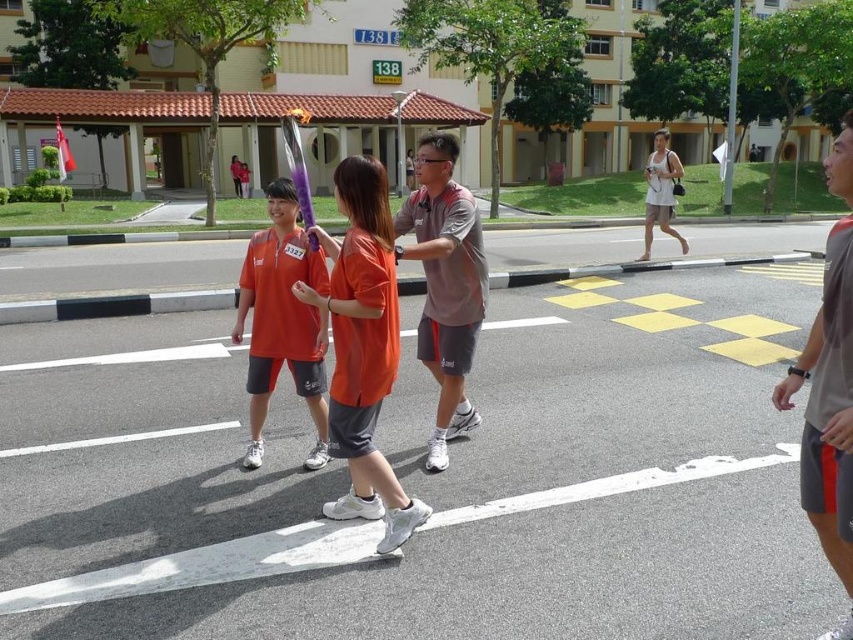
Question: Considering the real-world distances, which object is farthest from the gray matte shirt at center?

Choices:
 (A) gray fabric shorts at right
 (B) matte orange shirt at center

Answer: (A)

Question: Which of the following is the farthest from the observer?

Choices:
 (A) gray matte shirt at center
 (B) matte orange shirt at center
 (C) gray fabric shorts at right

Answer: (B)

Question: Estimate the real-world distances between objects in this image. Which object is farther from the matte orange shirt at center?

Choices:
 (A) gray matte shirt at center
 (B) gray fabric shorts at right

Answer: (B)

Question: Does gray matte shirt at center come behind matte orange shirt at center?

Choices:
 (A) yes
 (B) no

Answer: (B)

Question: Is the position of gray fabric shorts at right less distant than that of gray matte shirt at center?

Choices:
 (A) no
 (B) yes

Answer: (B)

Question: Is gray matte shirt at center in front of matte orange shirt at center?

Choices:
 (A) yes
 (B) no

Answer: (A)